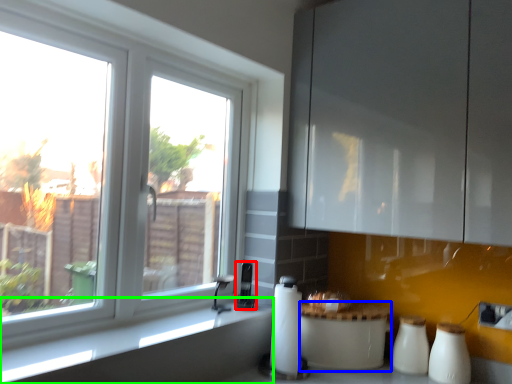
Question: Based on their relative distances, which object is nearer to appliance (highlighted by a red box)? Choose from appliance (highlighted by a blue box) and counter top (highlighted by a green box).

Choices:
 (A) appliance
 (B) counter top

Answer: (A)